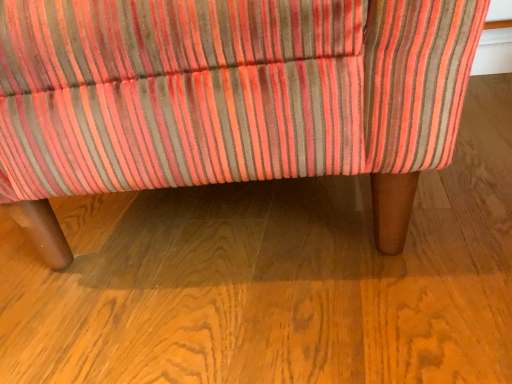
What do you see at coordinates (223, 93) in the screenshot? The image size is (512, 384). I see `velvet striped chair at center` at bounding box center [223, 93].

Identify the location of velvet striped chair at center. (223, 93).

Find the location of a particular element. velvet striped chair at center is located at coordinates (223, 93).